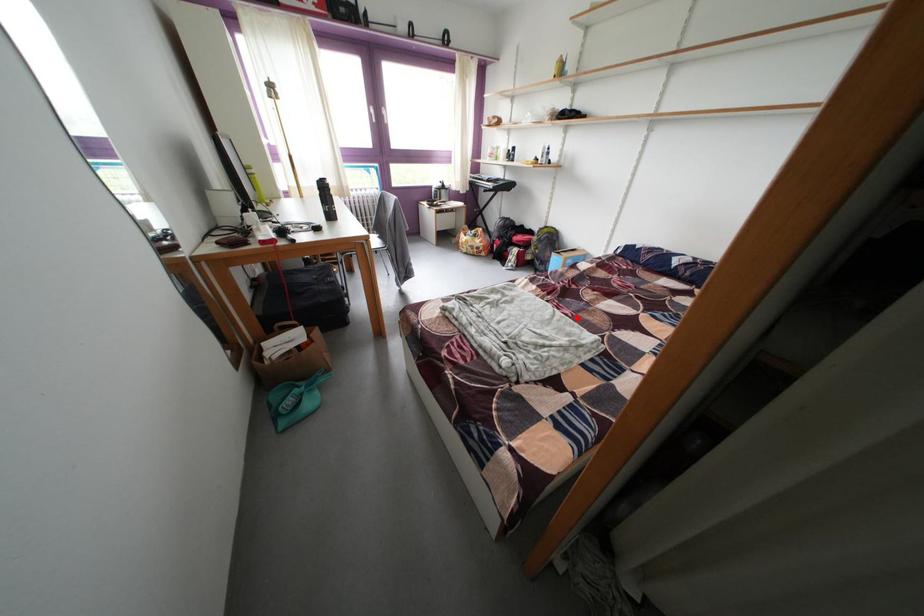
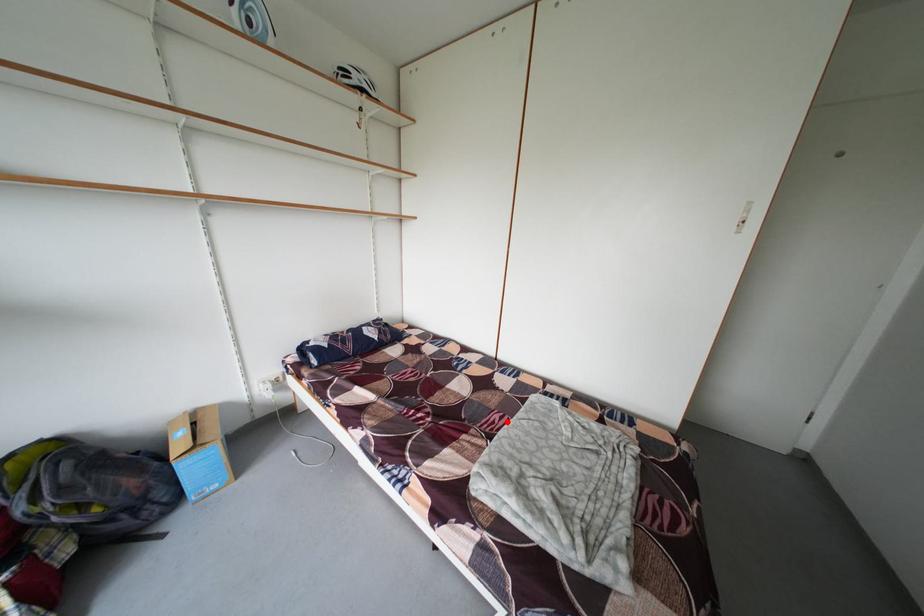
I am providing you with two images of the same scene from different viewpoints. A red point is marked on the first image and another point is marked on the second image. Is the marked point in image1 the same physical position as the marked point in image2?

Yes